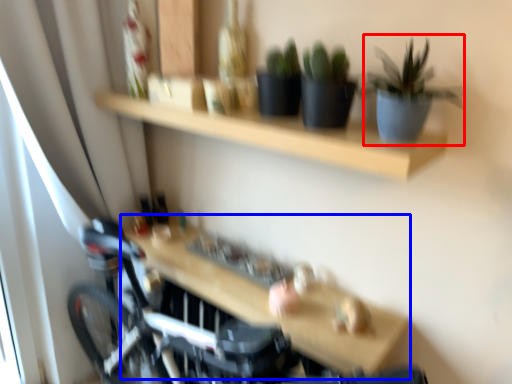
Question: Which of the following is the closest to the observer, houseplant (highlighted by a red box) or table (highlighted by a blue box)?

Choices:
 (A) houseplant
 (B) table

Answer: (A)